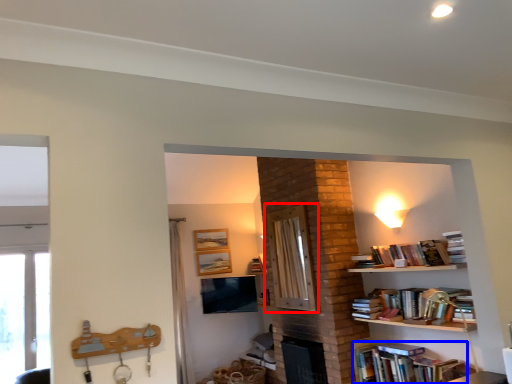
Question: Which object is closer to the camera taking this photo, screen door (highlighted by a red box) or book (highlighted by a blue box)?

Choices:
 (A) screen door
 (B) book

Answer: (B)